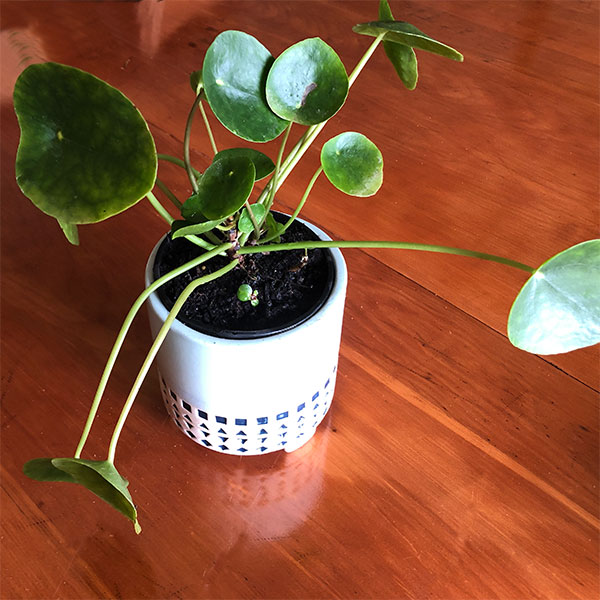
Identify the location of reflection of planter. The image size is (600, 600). (270, 506).